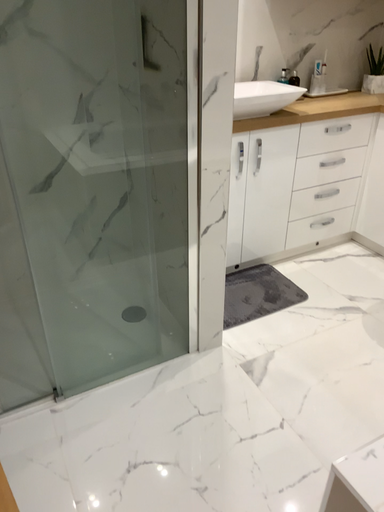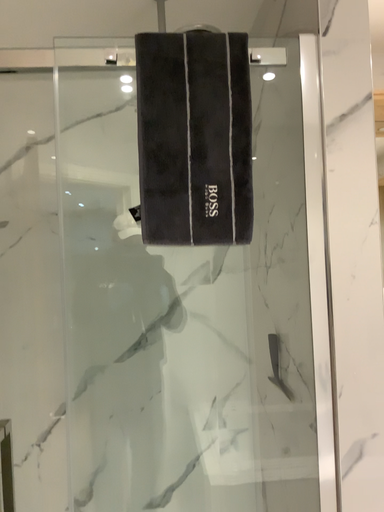
Question: How did the camera likely rotate when shooting the video?

Choices:
 (A) rotated right
 (B) rotated left

Answer: (B)